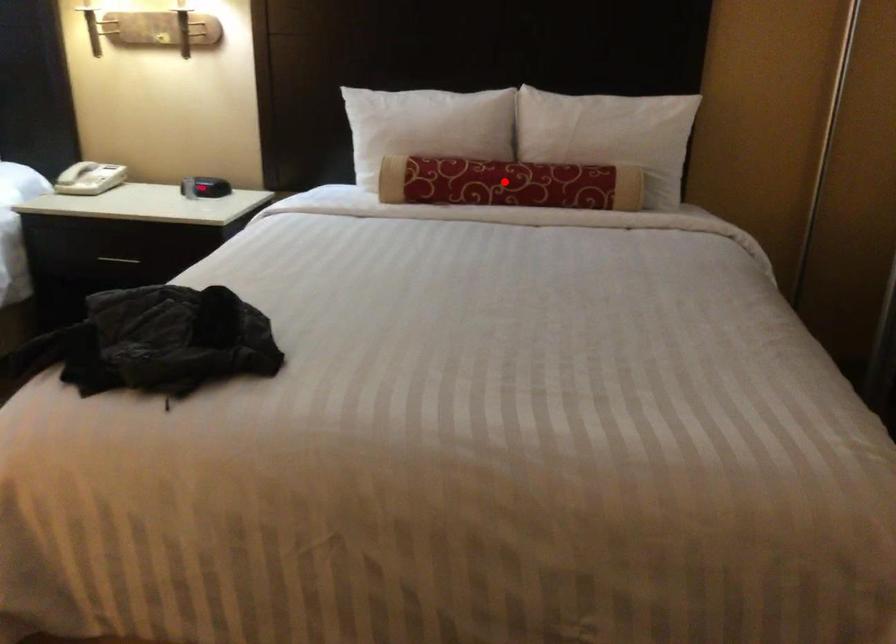
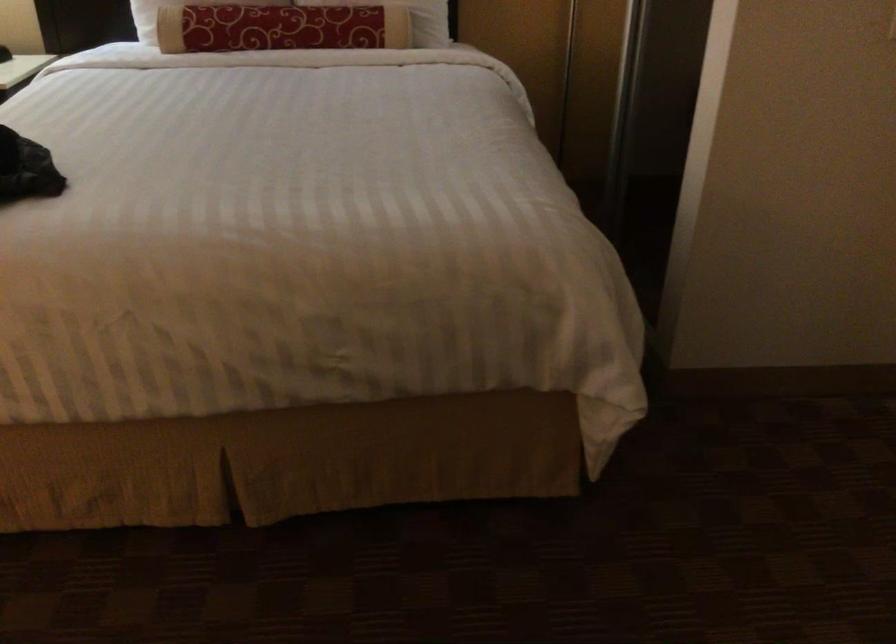
In the second image, find the point that corresponds to the highlighted location in the first image.

(280, 28)